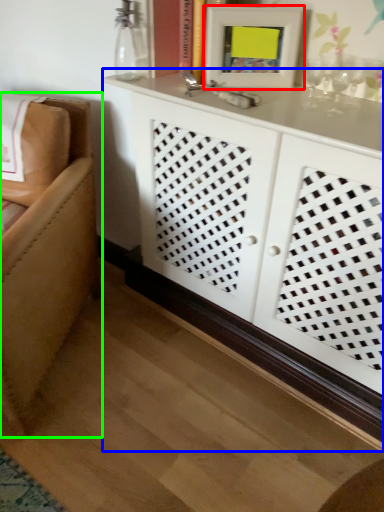
Question: Which is farther away from picture frame (highlighted by a red box)? cabinetry (highlighted by a blue box) or furniture (highlighted by a green box)?

Choices:
 (A) cabinetry
 (B) furniture

Answer: (B)